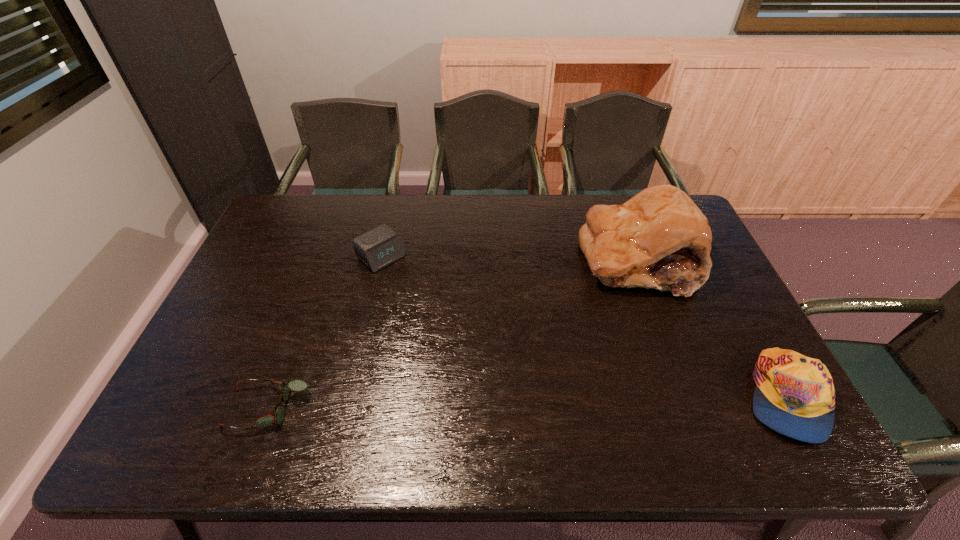
In order to click on vacant region between the spectacles and the second shortest object in this screenshot , I will do `click(324, 333)`.

The height and width of the screenshot is (540, 960). Find the location of `free space between the cap and the leftmost object`. free space between the cap and the leftmost object is located at coordinates (526, 402).

This screenshot has height=540, width=960. In order to click on free space that is in between the spectacles and the third shortest object in this screenshot , I will do `click(526, 402)`.

Find the location of `vacant area that lies between the bread and the cap`. vacant area that lies between the bread and the cap is located at coordinates (711, 328).

Identify the location of blank region between the cap and the second object from left to right. This screenshot has width=960, height=540. (584, 327).

Where is `vacant space that's between the cap and the bread`? vacant space that's between the cap and the bread is located at coordinates (711, 328).

Find the location of a particular element. The width and height of the screenshot is (960, 540). unoccupied area between the third shortest object and the third tallest object is located at coordinates (584, 327).

The width and height of the screenshot is (960, 540). Identify the location of the second closest object to the tallest object. (378, 248).

Locate which object is the second closest to the bread. Please provide its 2D coordinates. Your answer should be formatted as a tuple, i.e. [(x, y)], where the tuple contains the x and y coordinates of a point satisfying the conditions above.

[(378, 248)]